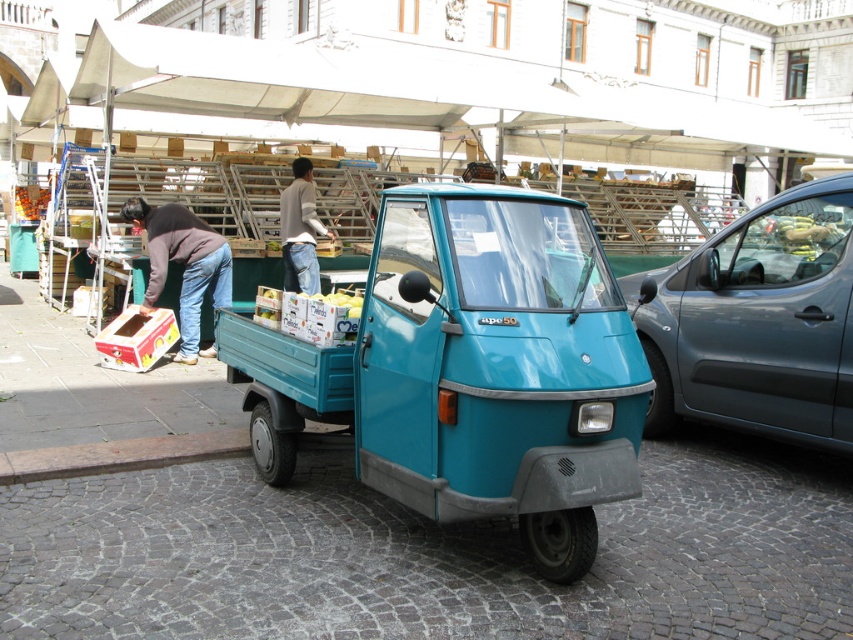
Question: Among these points, which one is farthest from the camera?

Choices:
 (A) (234, 349)
 (B) (811, 339)
 (C) (315, 208)
 (D) (167, 236)

Answer: (C)

Question: Which of these objects is positioned closest to the light brown denim jeans at center?

Choices:
 (A) metallic gray car at right
 (B) teal matte truck at center

Answer: (B)

Question: Can you confirm if teal matte truck at center is positioned above jeans at left?

Choices:
 (A) yes
 (B) no

Answer: (B)

Question: Which point appears closest to the camera in this image?

Choices:
 (A) (183, 212)
 (B) (619, 436)
 (C) (293, 188)

Answer: (B)

Question: Can you confirm if teal matte truck at center is wider than jeans at left?

Choices:
 (A) no
 (B) yes

Answer: (B)

Question: Considering the relative positions of teal matte truck at center and metallic gray car at right in the image provided, where is teal matte truck at center located with respect to metallic gray car at right?

Choices:
 (A) below
 (B) above

Answer: (A)